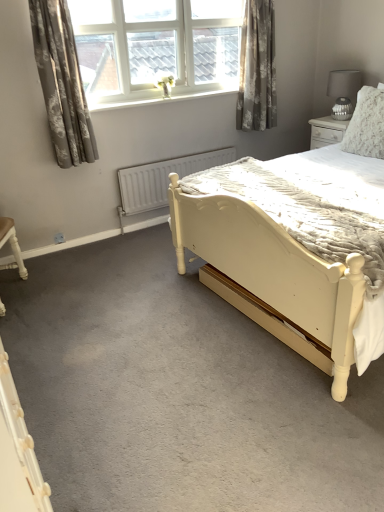
Question: From the image's perspective, does floral gray curtain at upper left, marked as the first curtain in a left-to-right arrangement, appear higher than matte gray lampshade at upper right?

Choices:
 (A) yes
 (B) no

Answer: (B)

Question: Is floral gray curtain at upper left, marked as the first curtain in a left-to-right arrangement, aimed at matte gray lampshade at upper right?

Choices:
 (A) yes
 (B) no

Answer: (B)

Question: From a real-world perspective, does floral gray curtain at upper left, marked as the first curtain in a left-to-right arrangement, stand above matte gray lampshade at upper right?

Choices:
 (A) yes
 (B) no

Answer: (A)

Question: Is floral gray curtain at upper left, marked as the first curtain in a left-to-right arrangement, bigger than matte gray lampshade at upper right?

Choices:
 (A) yes
 (B) no

Answer: (A)

Question: From the image's perspective, is floral gray curtain at upper left, positioned as the second curtain in right-to-left order, located beneath matte gray lampshade at upper right?

Choices:
 (A) yes
 (B) no

Answer: (A)

Question: Is floral gray curtain at upper left, the 1th curtain when ordered from front to back, surrounding matte gray lampshade at upper right?

Choices:
 (A) no
 (B) yes

Answer: (A)

Question: Is floral gray curtain at upper left, the 1th curtain when ordered from front to back, facing towards fluffy white pillow at upper right?

Choices:
 (A) no
 (B) yes

Answer: (A)

Question: Is the surface of floral gray curtain at upper left, positioned as the second curtain in right-to-left order, in direct contact with fluffy white pillow at upper right?

Choices:
 (A) no
 (B) yes

Answer: (A)

Question: From the image's perspective, is floral gray curtain at upper left, the 1th curtain when ordered from front to back, on top of fluffy white pillow at upper right?

Choices:
 (A) yes
 (B) no

Answer: (A)

Question: Can you confirm if floral gray curtain at upper left, the 1th curtain when ordered from front to back, is positioned to the left of fluffy white pillow at upper right?

Choices:
 (A) yes
 (B) no

Answer: (A)

Question: Is floral gray curtain at upper left, which appears as the second curtain when viewed from the back, thinner than fluffy white pillow at upper right?

Choices:
 (A) no
 (B) yes

Answer: (B)

Question: Does floral gray curtain at upper left, which appears as the second curtain when viewed from the back, have a larger size compared to fluffy white pillow at upper right?

Choices:
 (A) yes
 (B) no

Answer: (A)

Question: Can you confirm if matte gray lampshade at upper right is wider than floral gray curtain at upper left, which appears as the second curtain when viewed from the back?

Choices:
 (A) no
 (B) yes

Answer: (B)